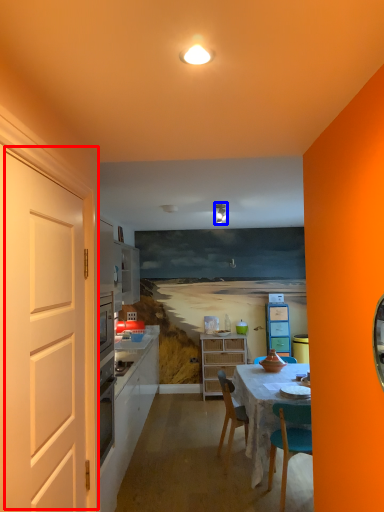
Question: Which point is further to the camera, door (highlighted by a red box) or light fixture (highlighted by a blue box)?

Choices:
 (A) door
 (B) light fixture

Answer: (B)